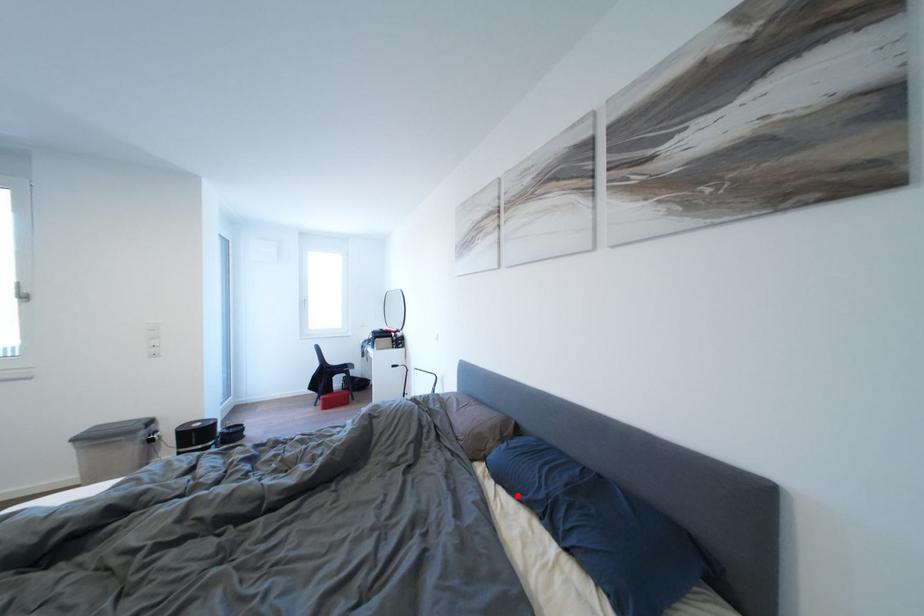
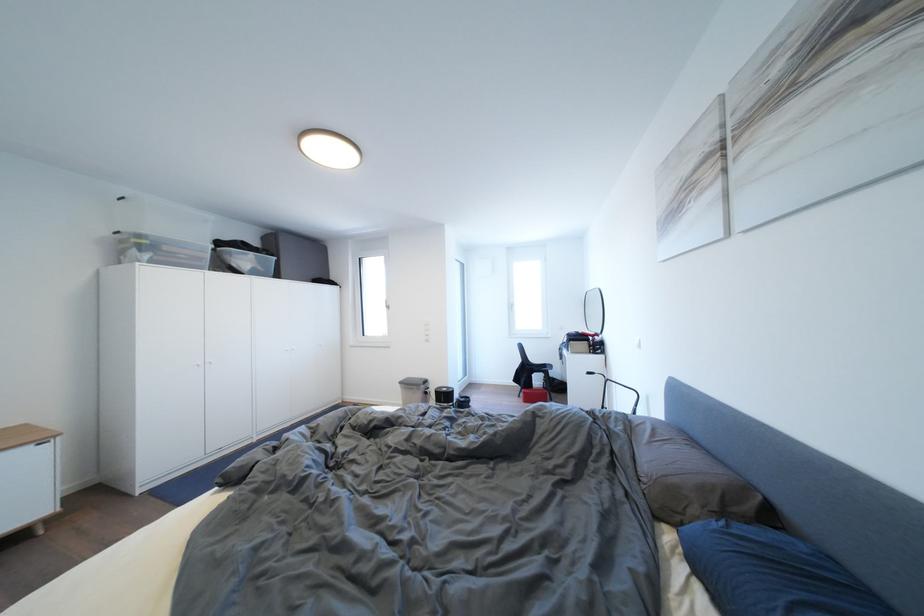
Find the pixel in the second image that matches the highlighted location in the first image.

(726, 607)